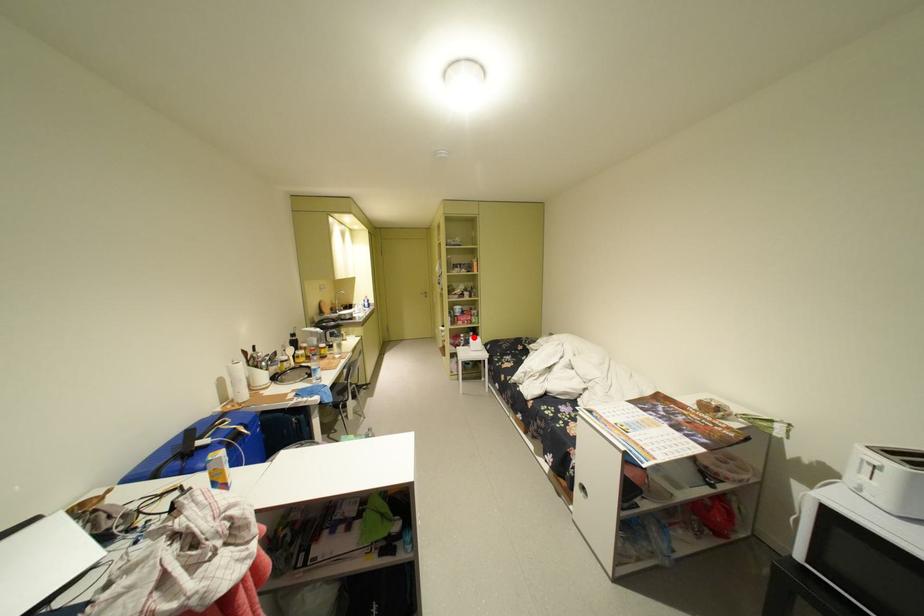
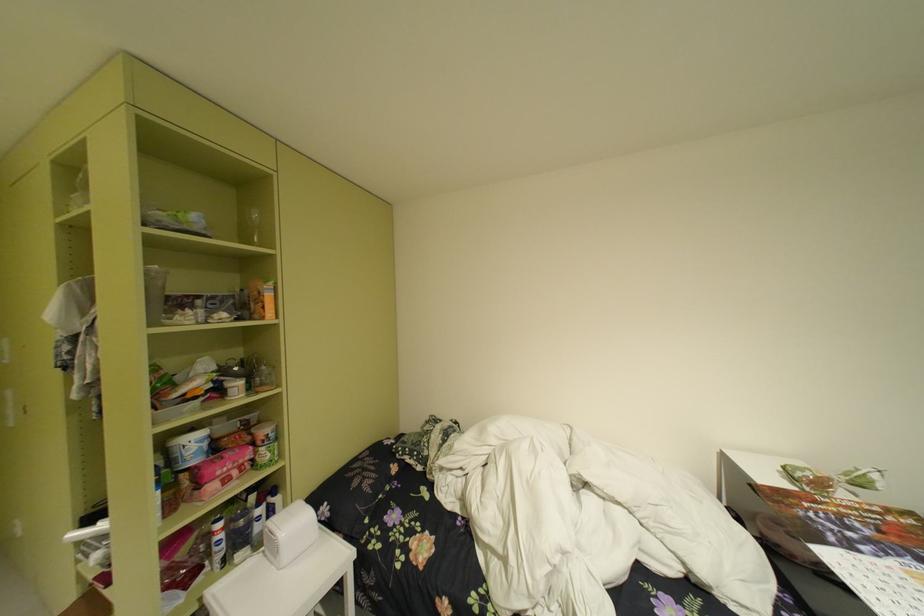
The point at the highlighted location is marked in the first image. Where is the corresponding point in the second image?

(235, 528)